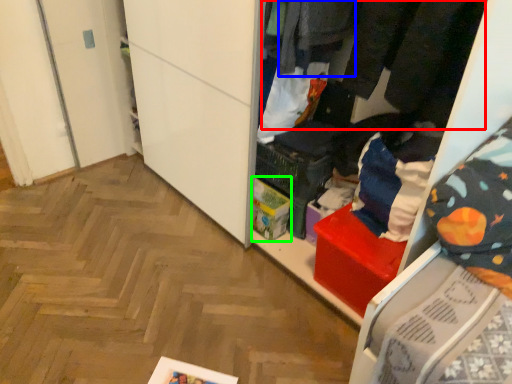
Question: Which is nearer to the clothing (highlighted by a red box)? clothing (highlighted by a blue box) or storage box (highlighted by a green box).

Choices:
 (A) clothing
 (B) storage box

Answer: (A)